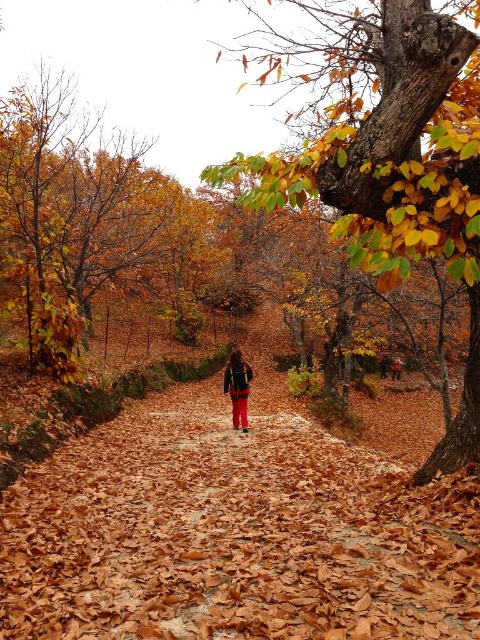
Question: Which point is closer to the camera taking this photo?

Choices:
 (A) (445, 600)
 (B) (457, 180)

Answer: (A)

Question: Among these objects, which one is farthest from the camera?

Choices:
 (A) brown leafy path at center
 (B) smooth bark tree at center

Answer: (B)

Question: Does smooth bark tree at center have a greater width compared to matte black backpack at center?

Choices:
 (A) no
 (B) yes

Answer: (B)

Question: Is brown leafy path at center wider than smooth bark tree at center?

Choices:
 (A) no
 (B) yes

Answer: (A)

Question: Can you confirm if smooth bark tree at center is smaller than matte black backpack at center?

Choices:
 (A) yes
 (B) no

Answer: (B)

Question: Estimate the real-world distances between objects in this image. Which object is closer to the smooth bark tree at center?

Choices:
 (A) matte black backpack at center
 (B) brown leafy path at center

Answer: (B)